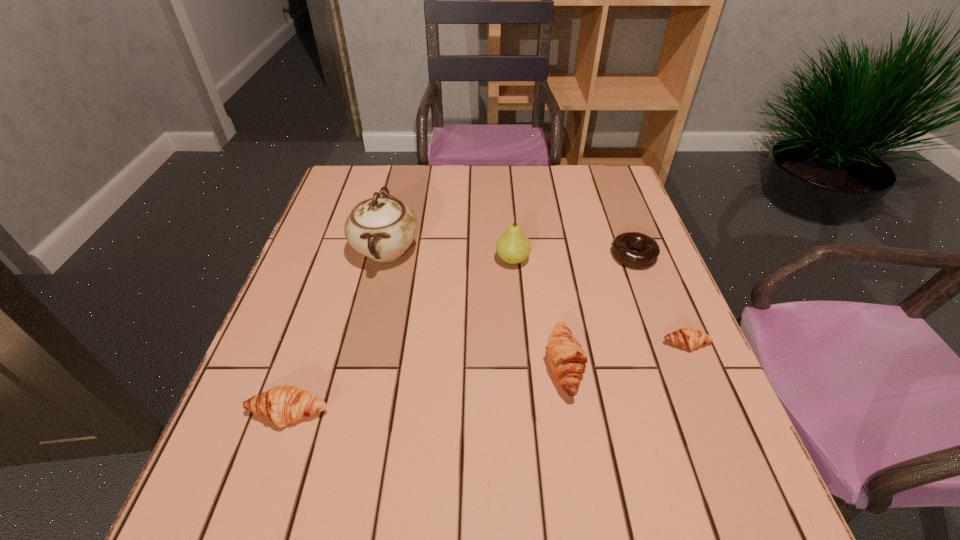
Find the location of a particular element. Image resolution: width=960 pixels, height=540 pixels. the leftmost pastry is located at coordinates pyautogui.click(x=282, y=405).

Image resolution: width=960 pixels, height=540 pixels. In order to click on the second tallest pastry in this screenshot , I will do `click(282, 405)`.

In order to click on the second pastry from right to left in this screenshot , I will do `click(567, 359)`.

The image size is (960, 540). In order to click on the rightmost pastry in this screenshot , I will do `click(687, 338)`.

You are a GUI agent. You are given a task and a screenshot of the screen. Output one action in this format:
    pyautogui.click(x=<x>, y=<y>)
    Task: Click on the tallest object
    
    Given the screenshot: What is the action you would take?
    pyautogui.click(x=382, y=228)

In order to click on pear in this screenshot , I will do `click(513, 247)`.

The height and width of the screenshot is (540, 960). In order to click on the third object from left to right in this screenshot , I will do `click(513, 247)`.

Locate an element on the screen. Image resolution: width=960 pixels, height=540 pixels. doughnut is located at coordinates point(621,245).

Where is `vacant region located on the front-facing side of the second pastry from right to left`? vacant region located on the front-facing side of the second pastry from right to left is located at coordinates (701, 365).

The width and height of the screenshot is (960, 540). I want to click on vacant area located 0.140m on the front-facing side of the shortest pastry, so click(716, 416).